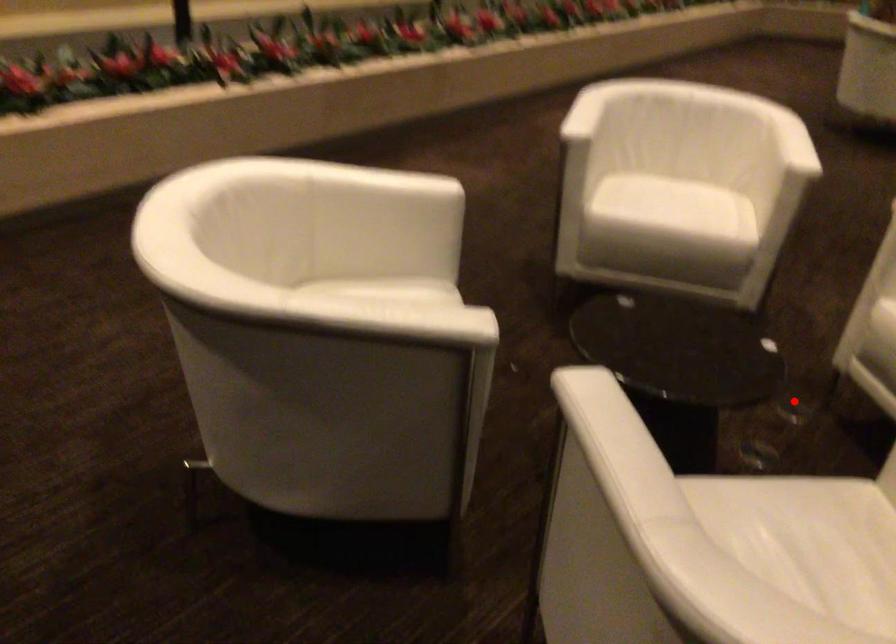
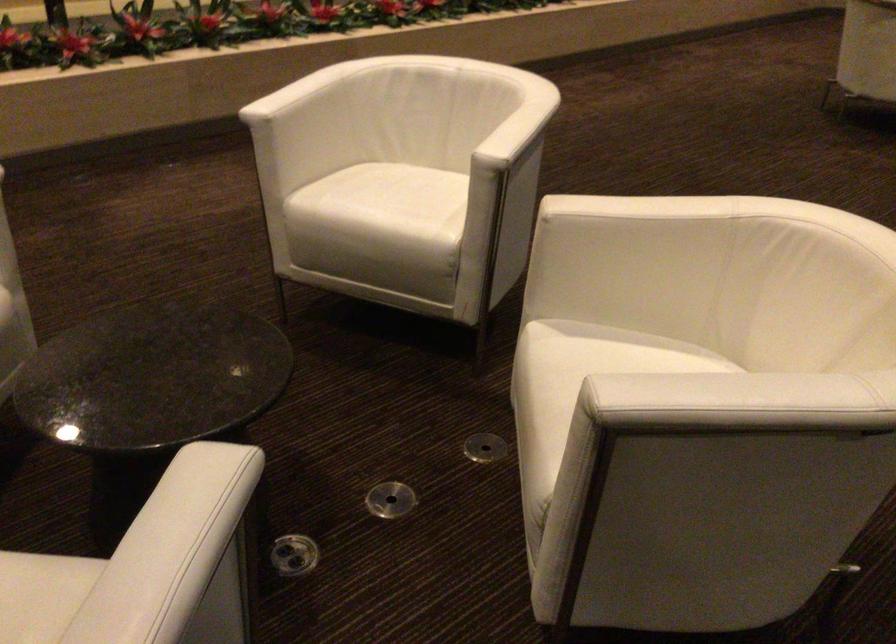
Question: A red point is marked in image1. In image2, is the corresponding 3D point closer to the camera or farther? Reply with the corresponding letter.

Choices:
 (A) The corresponding 3D point is closer.
 (B) The corresponding 3D point is farther.

Answer: (A)